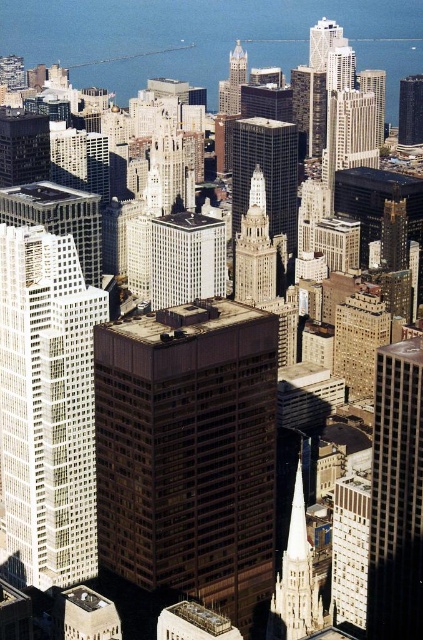
Does brown glassy building at center have a smaller size compared to brown glass skyscraper at upper right?

Incorrect, brown glassy building at center is not smaller in size than brown glass skyscraper at upper right.

This screenshot has width=423, height=640. What are the coordinates of `brown glassy building at center` in the screenshot? It's located at (189, 456).

Where is `brown glassy building at center`? The width and height of the screenshot is (423, 640). brown glassy building at center is located at coordinates (189, 456).

Based on the photo, who is positioned more to the right, brown glassy building at right or gold glass skyscraper at center?

Positioned to the right is brown glassy building at right.

Find the location of `brown glassy building at right`. brown glassy building at right is located at coordinates (397, 496).

This screenshot has width=423, height=640. What are the coordinates of `brown glassy building at right` in the screenshot? It's located at (397, 496).

Does point (422, 346) lie in front of point (398, 140)?

Yes.

At what (x,y) coordinates should I click in order to perform the action: click on brown glassy building at right. Please return your answer as a coordinate pair (x, y). Looking at the image, I should click on 397,496.